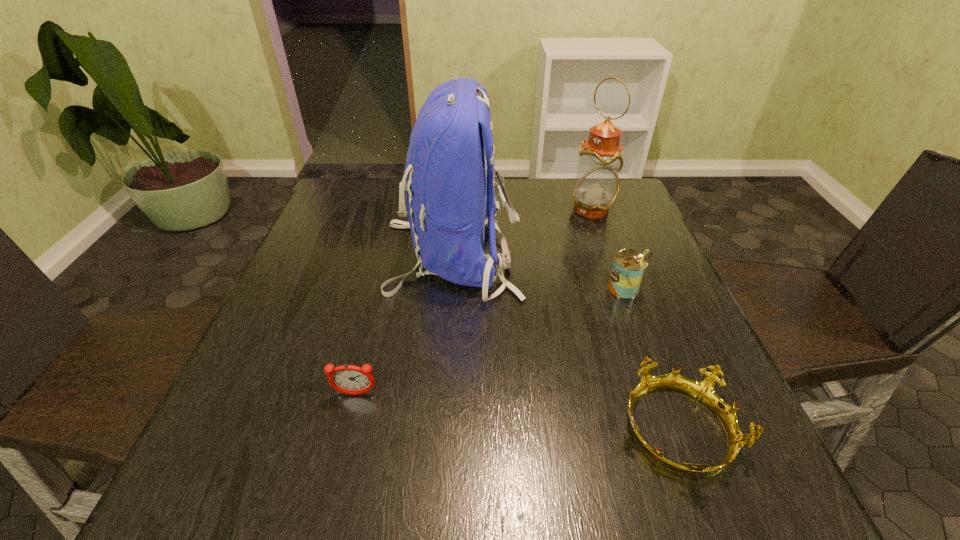
Identify the location of vacant area between the can and the oil lamp. (609, 249).

This screenshot has height=540, width=960. Find the location of `blank region between the alarm clock and the third tallest object`. blank region between the alarm clock and the third tallest object is located at coordinates (491, 342).

Where is `object that can be found as the closest to the can`? The image size is (960, 540). object that can be found as the closest to the can is located at coordinates (448, 199).

Identify which object is located as the second nearest to the third shortest object. Please provide its 2D coordinates. Your answer should be formatted as a tuple, i.e. [(x, y)], where the tuple contains the x and y coordinates of a point satisfying the conditions above.

[(703, 391)]

Where is `vacant point that satisfies the following two spatial constraints: 1. on the front-facing side of the alarm clock; 2. on the right side of the crown`? This screenshot has height=540, width=960. vacant point that satisfies the following two spatial constraints: 1. on the front-facing side of the alarm clock; 2. on the right side of the crown is located at coordinates tap(347, 430).

You are a GUI agent. You are given a task and a screenshot of the screen. Output one action in this format:
    pyautogui.click(x=<x>, y=<y>)
    Task: Click on the free space that satisfies the following two spatial constraints: 1. on the back of the backpack; 2. on the back side of the crown
    The image size is (960, 540).
    Given the screenshot: What is the action you would take?
    pyautogui.click(x=438, y=430)

Where is `vacant region that satisfies the following two spatial constraints: 1. on the back of the backpack; 2. on the front-facing side of the alarm clock`? The height and width of the screenshot is (540, 960). vacant region that satisfies the following two spatial constraints: 1. on the back of the backpack; 2. on the front-facing side of the alarm clock is located at coordinates (441, 394).

I want to click on free spot that satisfies the following two spatial constraints: 1. on the back of the backpack; 2. on the back side of the crown, so click(x=438, y=430).

The width and height of the screenshot is (960, 540). Identify the location of vacant area that satisfies the following two spatial constraints: 1. on the front side of the oil lamp; 2. on the back of the backpack. (608, 255).